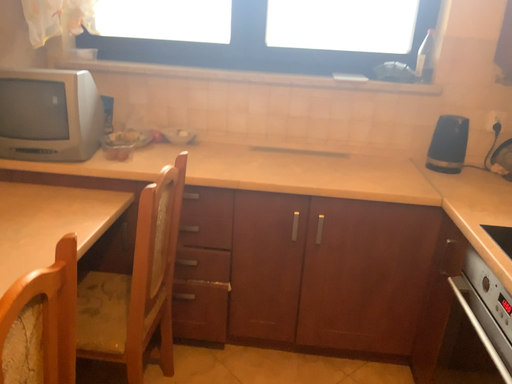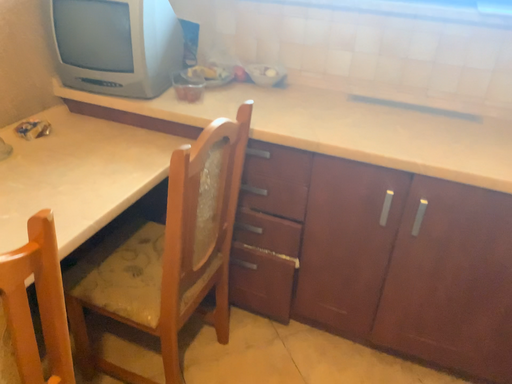
Question: Which way did the camera rotate in the video?

Choices:
 (A) rotated right
 (B) rotated left

Answer: (B)